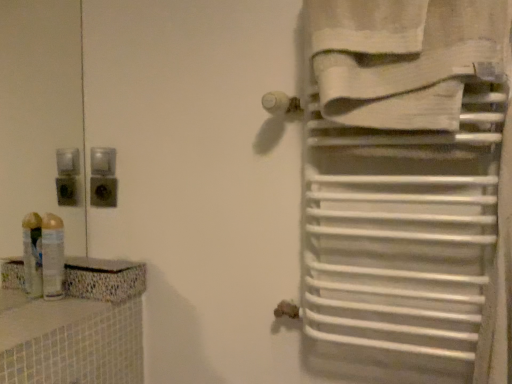
Question: In terms of height, does translucent plastic spray can at left look taller or shorter compared to white cotton towel at upper right?

Choices:
 (A) short
 (B) tall

Answer: (A)

Question: Does point (61, 248) appear closer or farther from the camera than point (338, 117)?

Choices:
 (A) farther
 (B) closer

Answer: (A)

Question: Considering the real-world distances, which object is farthest from the translucent plastic spray can at left?

Choices:
 (A) white cotton towel at upper right
 (B) black plastic outlet at upper left

Answer: (A)

Question: Considering the real-world distances, which object is farthest from the white cotton towel at upper right?

Choices:
 (A) black plastic outlet at upper left
 (B) translucent plastic spray can at left

Answer: (B)